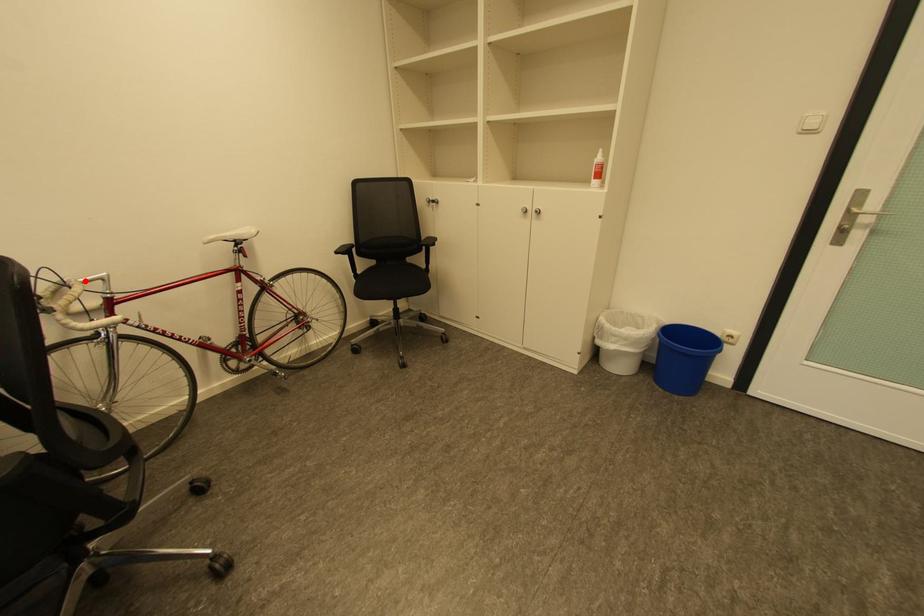
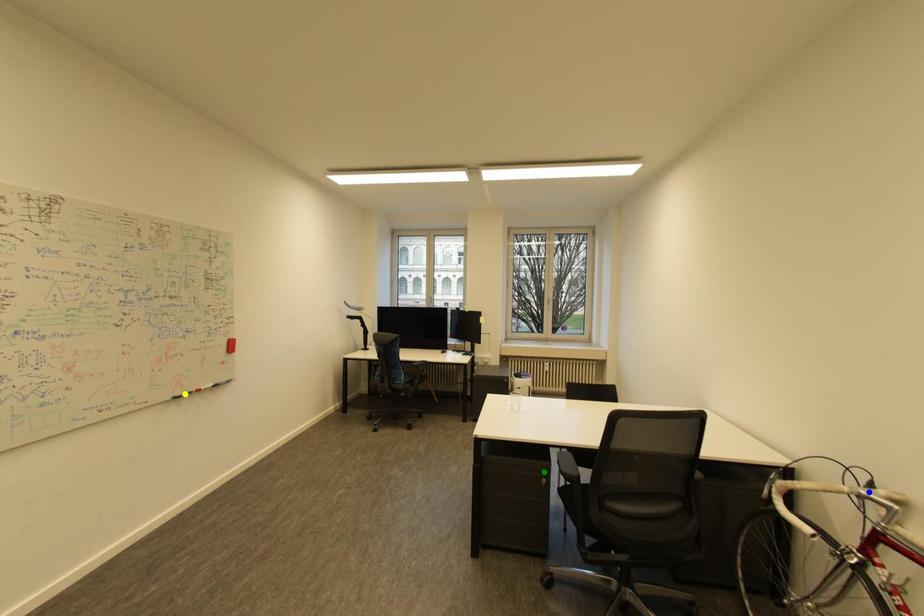
Question: I am providing you with two images of the same scene from different viewpoints. A red point is marked on the first image. You are given multiple points on the second image. Can you choose the point in image 2 that corresponds to the point in image 1?

Choices:
 (A) yellow point
 (B) blue point
 (C) green point

Answer: (B)